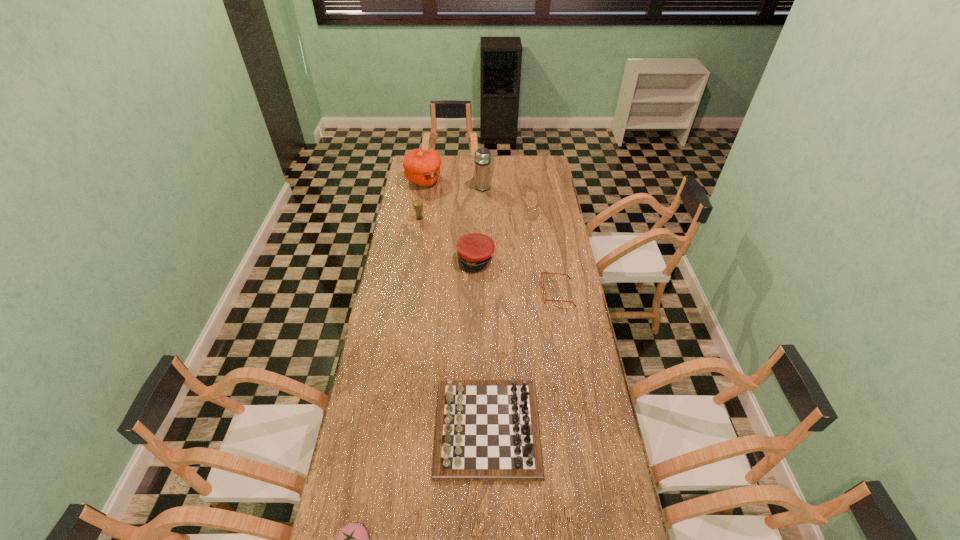
Image resolution: width=960 pixels, height=540 pixels. Identify the location of free location located 0.180m with a handle on the side of the thermos bottle. (483, 165).

Where is `free space located 0.150m on the front of the second tallest object`? free space located 0.150m on the front of the second tallest object is located at coordinates (420, 207).

Identify the location of vacant position located 0.270m on the back of the third tallest object. This screenshot has height=540, width=960. coord(424,187).

This screenshot has height=540, width=960. I want to click on vacant space located on the front of the cap with an emblem, so click(474, 334).

Locate an element on the screen. The width and height of the screenshot is (960, 540). free space located from the player's perspective of the sixth farthest object is located at coordinates (401, 428).

Identify the location of free space located 0.250m from the player's perspective of the sixth farthest object. (364, 428).

The image size is (960, 540). I want to click on vacant space located 0.240m from the player's perspective of the sixth farthest object, so click(367, 428).

Where is `vacant region located 0.070m on the face of the rightmost object`? The height and width of the screenshot is (540, 960). vacant region located 0.070m on the face of the rightmost object is located at coordinates (527, 293).

At what (x,y) coordinates should I click in order to perform the action: click on free space located on the face of the rightmost object. Please return your answer as a coordinate pair (x, y). This screenshot has width=960, height=540. Looking at the image, I should click on (514, 293).

Image resolution: width=960 pixels, height=540 pixels. I want to click on free space located on the face of the rightmost object, so (512, 293).